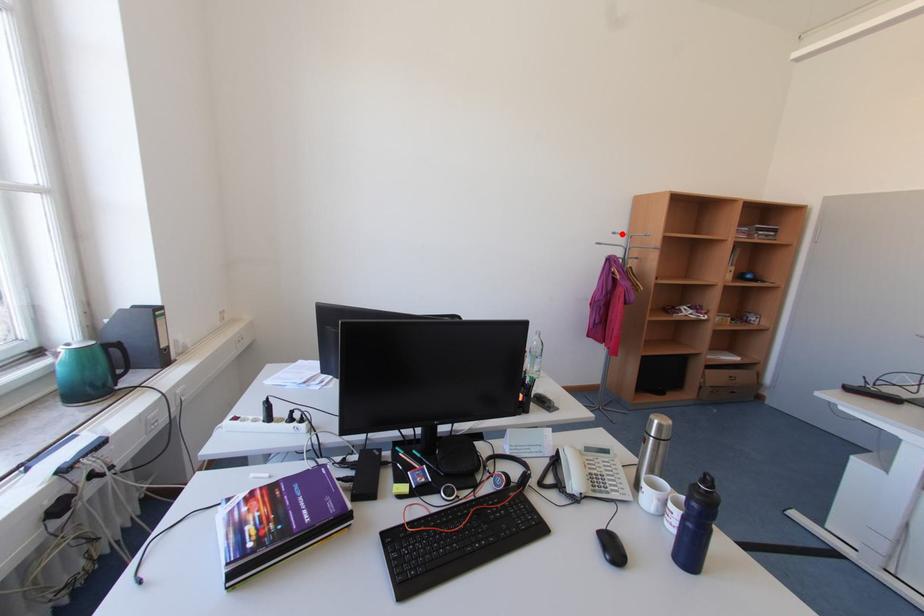
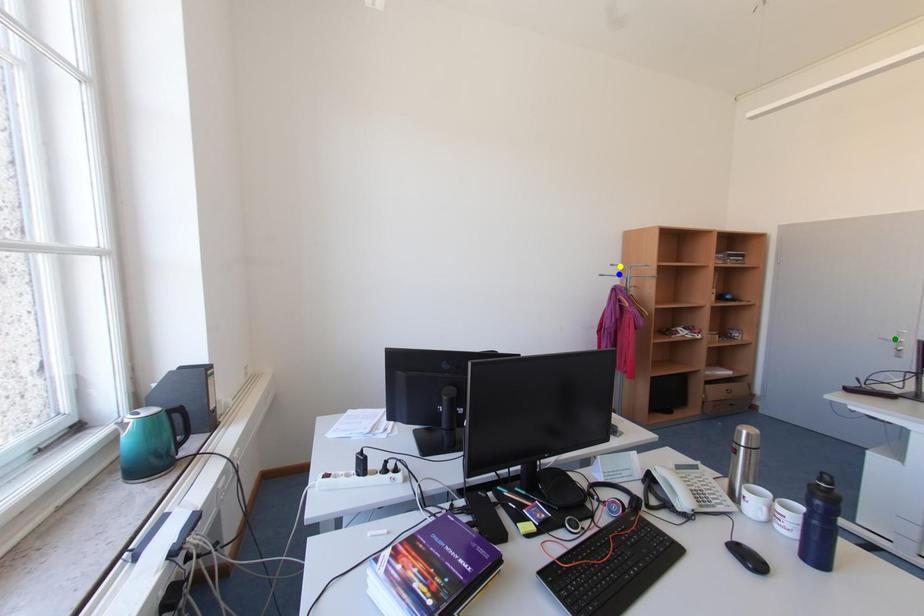
Question: I am providing you with two images of the same scene from different viewpoints. A red point is marked on the first image. You are given multiple points on the second image. Can you choose the point in image 2 that corresponds to the point in image 1?

Choices:
 (A) yellow point
 (B) green point
 (C) blue point

Answer: (A)